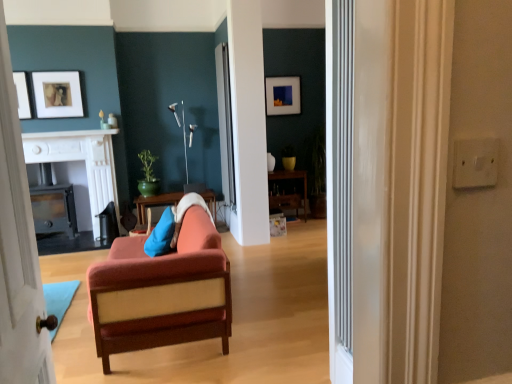
Question: Considering the relative sizes of white glossy fireplace at upper center and blue fabric pillow at center in the image provided, is white glossy fireplace at upper center taller than blue fabric pillow at center?

Choices:
 (A) yes
 (B) no

Answer: (B)

Question: Considering the relative positions of white glossy fireplace at upper center and blue fabric pillow at center in the image provided, is white glossy fireplace at upper center to the left of blue fabric pillow at center from the viewer's perspective?

Choices:
 (A) yes
 (B) no

Answer: (A)

Question: Is white glossy fireplace at upper center not within blue fabric pillow at center?

Choices:
 (A) yes
 (B) no

Answer: (A)

Question: Is white glossy fireplace at upper center aimed at blue fabric pillow at center?

Choices:
 (A) yes
 (B) no

Answer: (B)

Question: Considering the relative sizes of white glossy fireplace at upper center and blue fabric pillow at center in the image provided, is white glossy fireplace at upper center wider than blue fabric pillow at center?

Choices:
 (A) yes
 (B) no

Answer: (A)

Question: From a real-world perspective, is white glossy fireplace at upper center located higher than blue fabric pillow at center?

Choices:
 (A) yes
 (B) no

Answer: (A)

Question: Is the depth of wooden cabinet at center, arranged as the 2th table when viewed from the left, greater than that of clear glass door at center?

Choices:
 (A) no
 (B) yes

Answer: (B)

Question: Does wooden cabinet at center, which is the 1th table in right-to-left order, appear on the left side of clear glass door at center?

Choices:
 (A) yes
 (B) no

Answer: (B)

Question: From the image's perspective, is wooden cabinet at center, which is the 1th table in right-to-left order, on top of clear glass door at center?

Choices:
 (A) yes
 (B) no

Answer: (B)

Question: Is wooden cabinet at center, arranged as the 2th table when viewed from the left, positioned with its back to clear glass door at center?

Choices:
 (A) yes
 (B) no

Answer: (B)

Question: Can you confirm if wooden cabinet at center, arranged as the 2th table when viewed from the left, is taller than clear glass door at center?

Choices:
 (A) yes
 (B) no

Answer: (B)

Question: Would you say clear glass door at center is part of wooden cabinet at center, arranged as the 2th table when viewed from the left,'s contents?

Choices:
 (A) yes
 (B) no

Answer: (B)

Question: Does clear glass door at center lie behind white painted wood door at left?

Choices:
 (A) no
 (B) yes

Answer: (B)